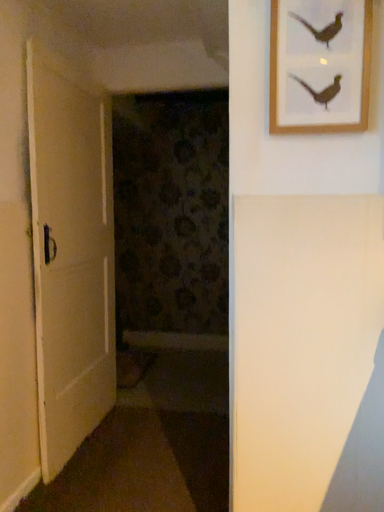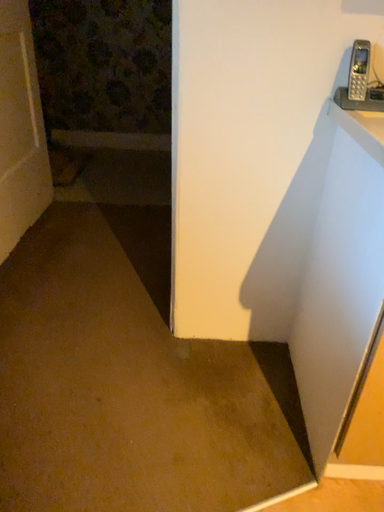
Question: How did the camera likely rotate when shooting the video?

Choices:
 (A) rotated right
 (B) rotated left

Answer: (A)